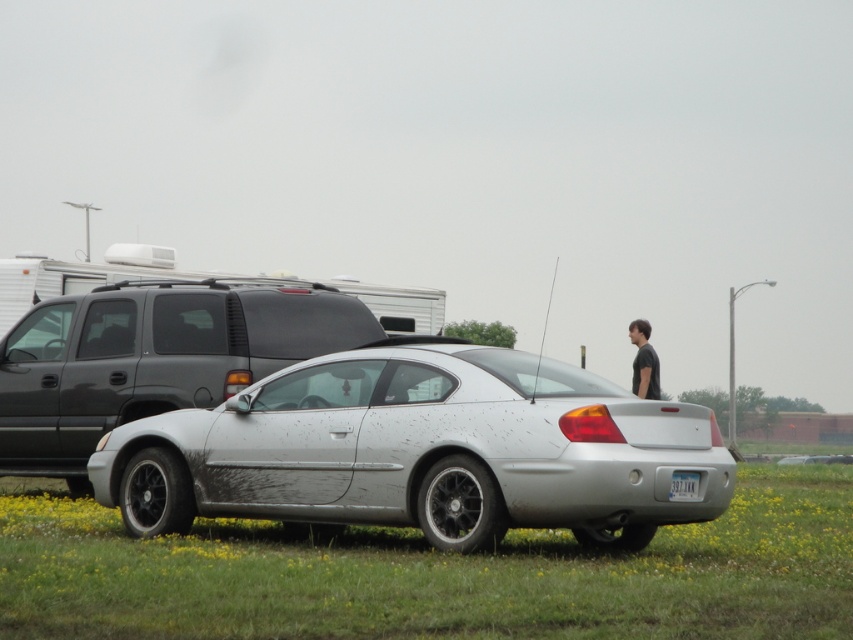
Who is positioned more to the left, dark gray shirt at right or white plastic license plate at center?

Positioned to the left is white plastic license plate at center.

Is point (641, 344) behind point (683, 486)?

Yes.

Locate an element on the screen. This screenshot has height=640, width=853. dark gray shirt at right is located at coordinates click(643, 362).

Can you confirm if green grass at lower center is bigger than matte black suv at center?

Indeed, green grass at lower center has a larger size compared to matte black suv at center.

Who is lower down, green grass at lower center or matte black suv at center?

green grass at lower center is lower down.

Locate an element on the screen. green grass at lower center is located at coordinates (434, 576).

Between matte black suv at center and dark gray shirt at right, which one appears on the left side from the viewer's perspective?

From the viewer's perspective, matte black suv at center appears more on the left side.

What do you see at coordinates (151, 358) in the screenshot? The width and height of the screenshot is (853, 640). I see `matte black suv at center` at bounding box center [151, 358].

What do you see at coordinates (151, 358) in the screenshot?
I see `matte black suv at center` at bounding box center [151, 358].

This screenshot has width=853, height=640. In order to click on matte black suv at center in this screenshot , I will do `click(151, 358)`.